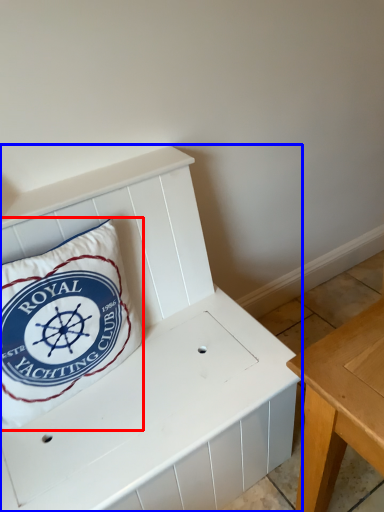
Question: Which of the following is the closest to the observer, pillow (highlighted by a red box) or furniture (highlighted by a blue box)?

Choices:
 (A) pillow
 (B) furniture

Answer: (B)